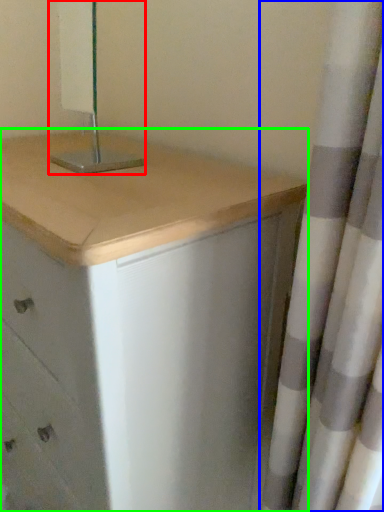
Question: Considering the real-world distances, which object is farthest from bedside lamp (highlighted by a red box)? curtain (highlighted by a blue box) or chest of drawers (highlighted by a green box)?

Choices:
 (A) curtain
 (B) chest of drawers

Answer: (A)